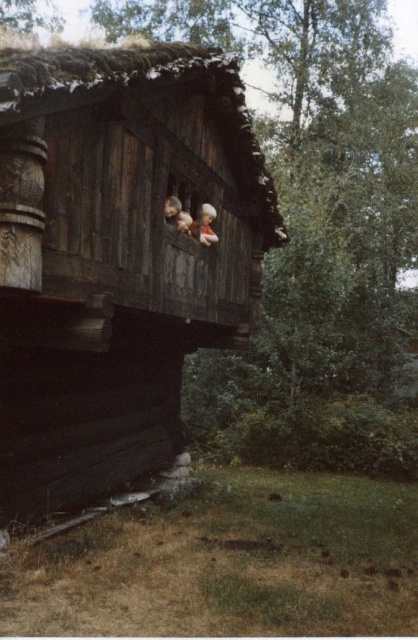
You are standing in front of the dark brown wooden log cabin at center and want to place a smooth wooden doll at upper center on a shelf inside the cabin. Since the cabin is closer to you, will the doll be visible from your current position?

The dark brown wooden log cabin at center is closer to the viewer than the smooth wooden doll at upper center, so the doll will be visible from your current position as it is placed inside the cabin which is in front of it.

You are a visitor standing in front of the dark brown wooden log cabin at center and the smooth wooden doll at upper center. Which object is taller?

The smooth wooden doll at upper center is taller than the dark brown wooden log cabin at center.

You are planning to build a model of the dark brown wooden log cabin at center and the smooth wooden doll at upper center. If the model must maintain the same proportions as the original, which object should you scale down more to fit both within a 10 cm width limit?

The dark brown wooden log cabin at center must be scaled down more because its width is less than the smooth wooden doll at upper center, so to fit both within the 10 cm limit, the cabin requires a smaller scale to match the doll.